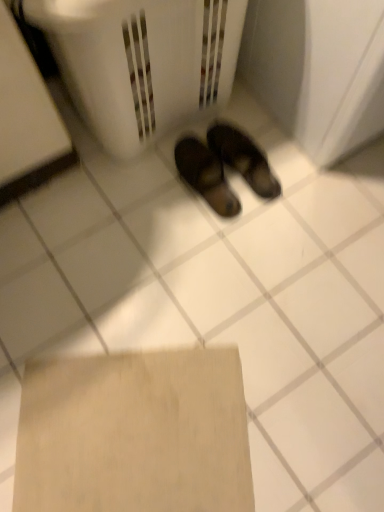
Question: Is white plastic laundry basket at center shorter than brown leather sandals at center?

Choices:
 (A) yes
 (B) no

Answer: (B)

Question: Is white plastic laundry basket at center to the left of brown leather sandals at center from the viewer's perspective?

Choices:
 (A) no
 (B) yes

Answer: (B)

Question: Considering the relative positions of white plastic laundry basket at center and brown leather sandals at center in the image provided, is white plastic laundry basket at center behind brown leather sandals at center?

Choices:
 (A) no
 (B) yes

Answer: (A)

Question: Considering the relative sizes of white plastic laundry basket at center and brown leather sandals at center in the image provided, is white plastic laundry basket at center taller than brown leather sandals at center?

Choices:
 (A) no
 (B) yes

Answer: (B)

Question: Can you confirm if white plastic laundry basket at center is thinner than brown leather sandals at center?

Choices:
 (A) no
 (B) yes

Answer: (A)

Question: From the image's perspective, is white plastic laundry basket at center under brown leather sandals at center?

Choices:
 (A) yes
 (B) no

Answer: (B)

Question: Considering the relative sizes of beige cardboard at lower center and white plastic laundry basket at center in the image provided, is beige cardboard at lower center thinner than white plastic laundry basket at center?

Choices:
 (A) yes
 (B) no

Answer: (B)

Question: From the image's perspective, is beige cardboard at lower center located beneath white plastic laundry basket at center?

Choices:
 (A) yes
 (B) no

Answer: (A)

Question: Considering the relative sizes of beige cardboard at lower center and white plastic laundry basket at center in the image provided, is beige cardboard at lower center bigger than white plastic laundry basket at center?

Choices:
 (A) yes
 (B) no

Answer: (B)

Question: Can you confirm if beige cardboard at lower center is wider than white plastic laundry basket at center?

Choices:
 (A) no
 (B) yes

Answer: (B)

Question: From a real-world perspective, is beige cardboard at lower center under white plastic laundry basket at center?

Choices:
 (A) yes
 (B) no

Answer: (A)

Question: Is beige cardboard at lower center positioned with its back to white plastic laundry basket at center?

Choices:
 (A) yes
 (B) no

Answer: (B)

Question: Is white plastic laundry basket at center positioned far away from beige cardboard at lower center?

Choices:
 (A) no
 (B) yes

Answer: (A)